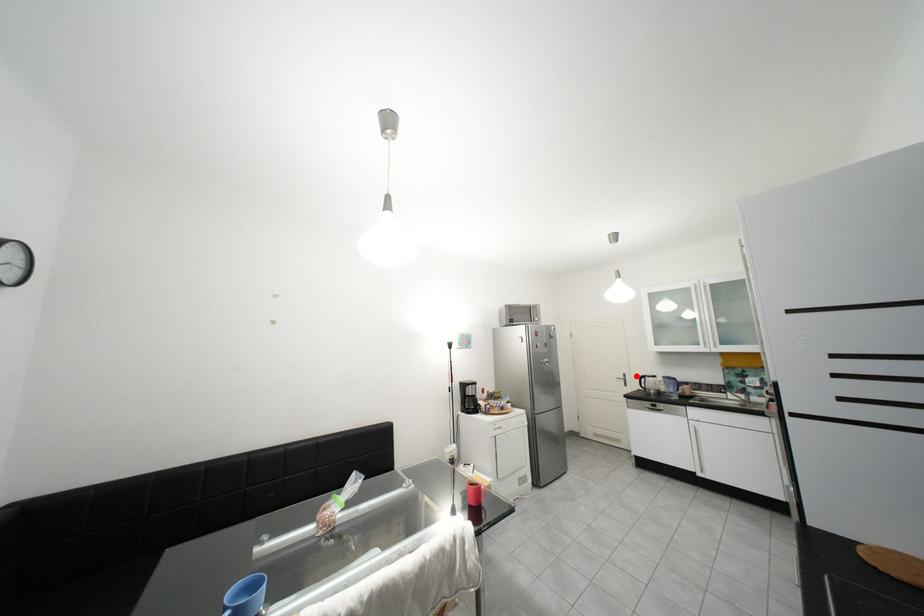
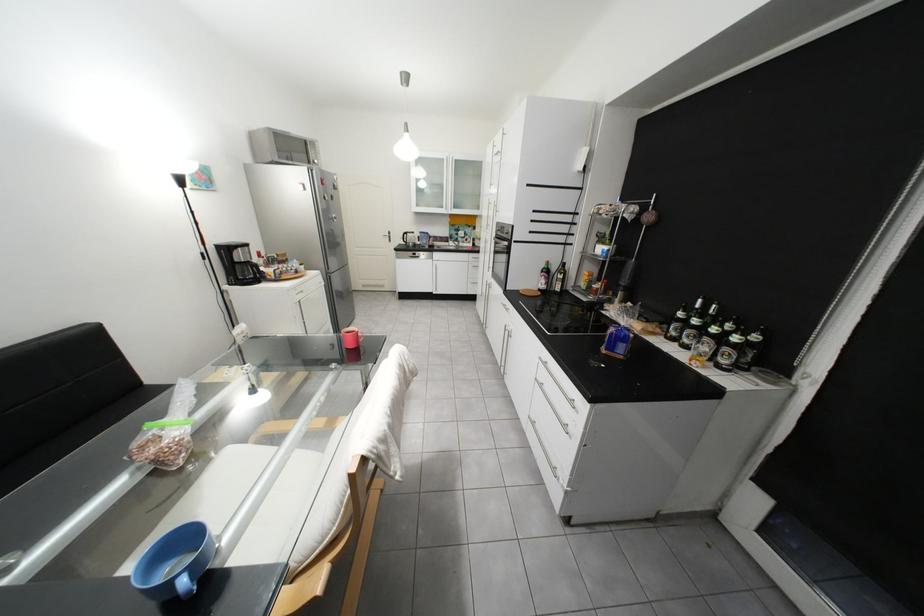
Question: A red point is marked in image1. In image2, is the corresponding 3D point closer to the camera or farther? Reply with the corresponding letter.

Choices:
 (A) The corresponding 3D point is closer.
 (B) The corresponding 3D point is farther.

Answer: (A)